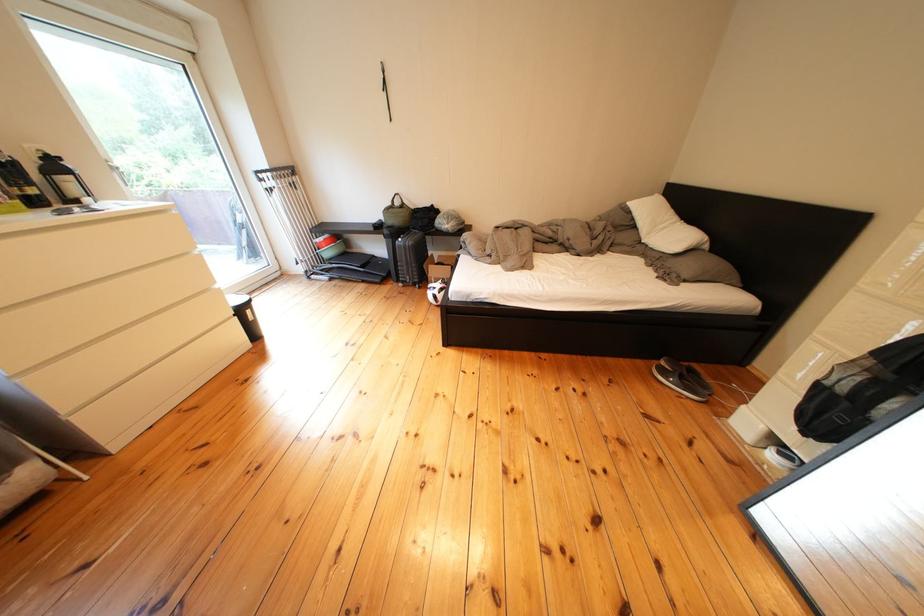
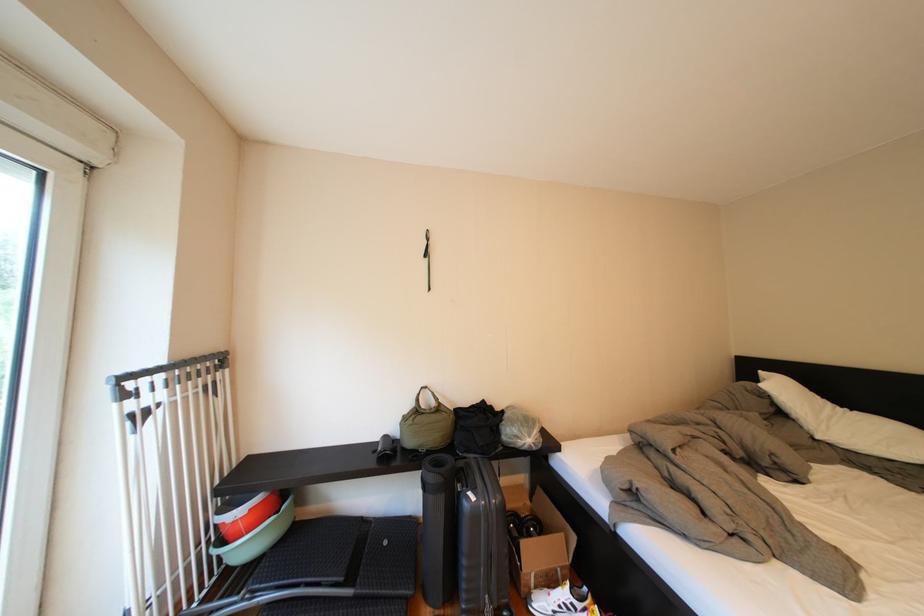
In the second image, find the point that corresponds to the point at 649,230 in the first image.

(795, 419)